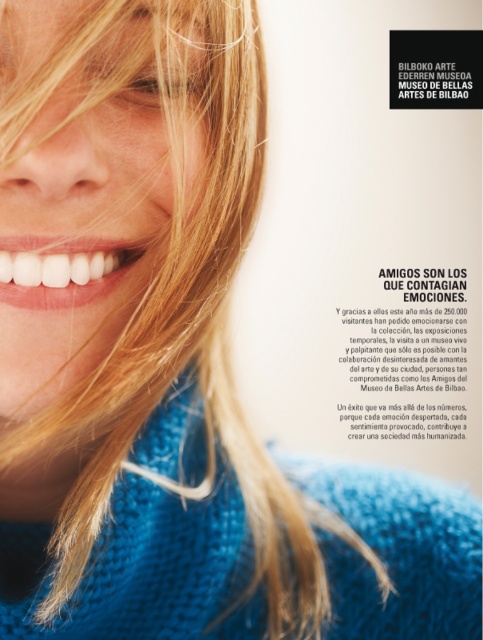
Question: Which point is closer to the camera taking this photo?

Choices:
 (A) (107, 141)
 (B) (31, 269)

Answer: (A)

Question: Does blonde hair at upper left appear on the left side of white glossy teeth at center?

Choices:
 (A) no
 (B) yes

Answer: (A)

Question: Among these points, which one is nearest to the camera?

Choices:
 (A) click(157, 106)
 (B) click(69, 282)

Answer: (A)

Question: Which point is closer to the camera?

Choices:
 (A) white glossy teeth at center
 (B) blonde hair at upper left

Answer: (B)

Question: Can you confirm if blonde hair at upper left is smaller than white glossy teeth at center?

Choices:
 (A) no
 (B) yes

Answer: (A)

Question: Does blonde hair at upper left have a lesser width compared to white glossy teeth at center?

Choices:
 (A) no
 (B) yes

Answer: (A)